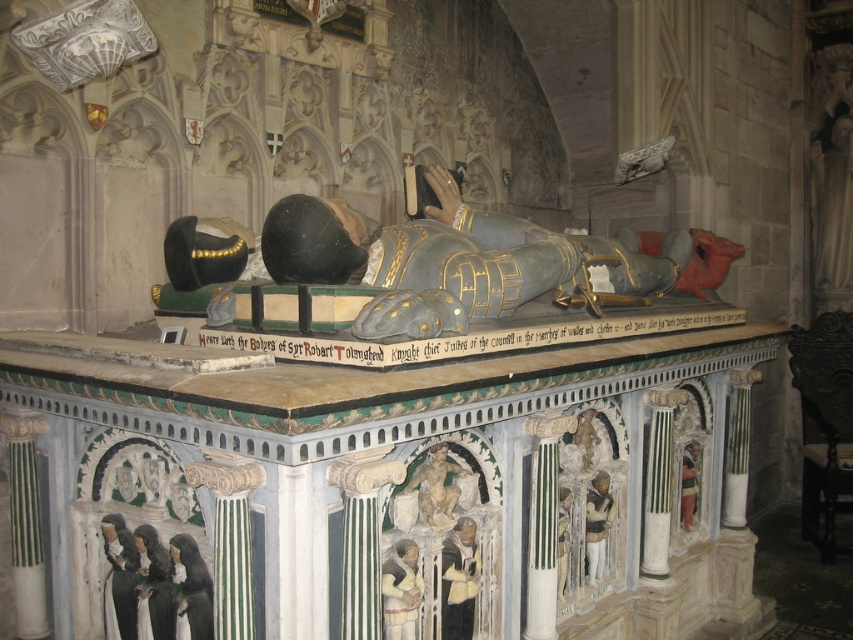
Who is lower down, polished silver armor at center or stone figure at center?

Positioned lower is stone figure at center.

Does polished silver armor at center appear on the left side of stone figure at center?

In fact, polished silver armor at center is to the right of stone figure at center.

Which is behind, point (460, 266) or point (427, 460)?

The point (460, 266) is more distant.

You are a GUI agent. You are given a task and a screenshot of the screen. Output one action in this format:
    pyautogui.click(x=<x>, y=<y>)
    Task: Click on the polished silver armor at center
    This screenshot has height=640, width=853.
    Given the screenshot: What is the action you would take?
    pyautogui.click(x=451, y=266)